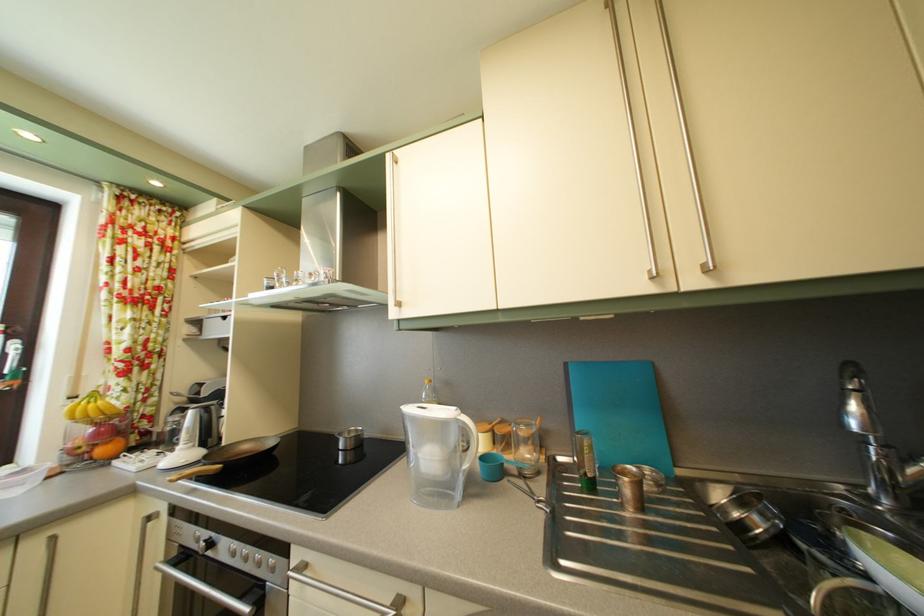
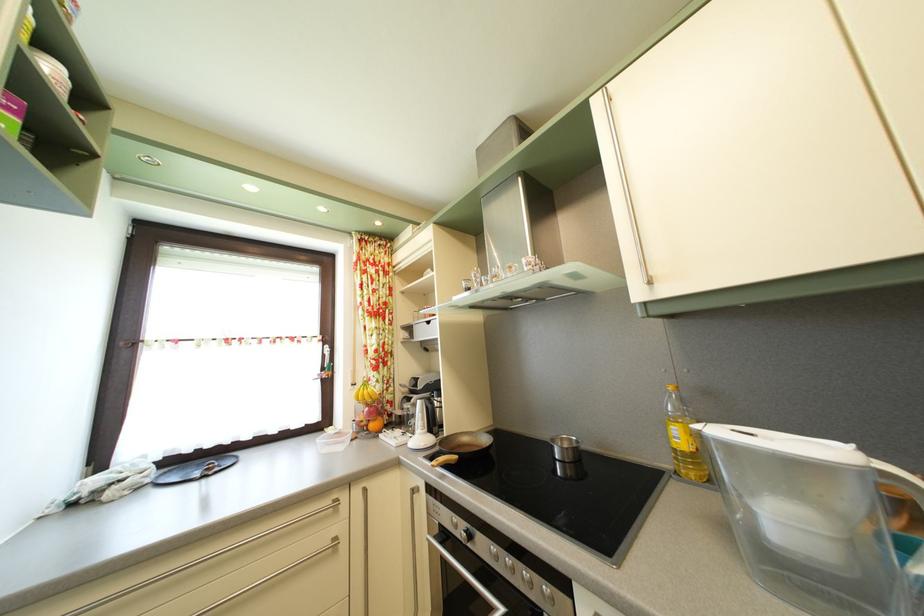
In the second image, find the point that corresponds to point 188,418 in the first image.

(417, 407)